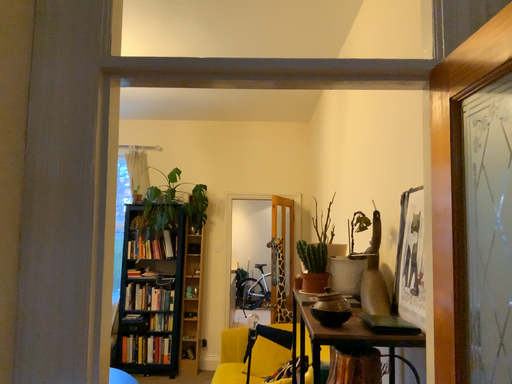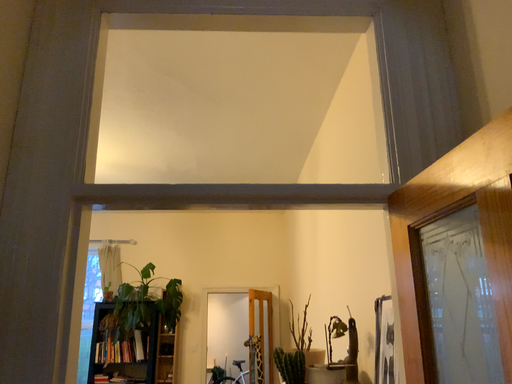
Question: Which way did the camera rotate in the video?

Choices:
 (A) rotated upward
 (B) rotated downward

Answer: (A)